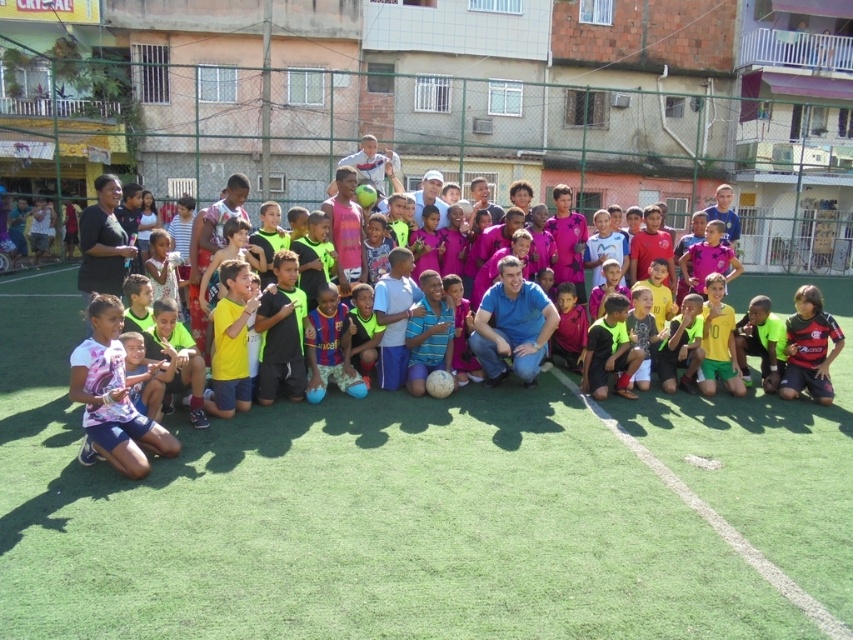
Is pink jersey at lower left behind pink fabric football team at center?

No, pink jersey at lower left is closer to the viewer.

This screenshot has height=640, width=853. What do you see at coordinates (112, 397) in the screenshot?
I see `pink jersey at lower left` at bounding box center [112, 397].

Where is `pink jersey at lower left`? The image size is (853, 640). pink jersey at lower left is located at coordinates (112, 397).

Based on the photo, does blue jersey at center come behind yellow jersey at lower center?

No, it is not.

Can you confirm if blue jersey at center is taller than yellow jersey at lower center?

Incorrect, blue jersey at center's height is not larger of yellow jersey at lower center's.

Who is more distant from viewer, [309,387] or [628,394]?

The point [628,394] is behind.

The height and width of the screenshot is (640, 853). In order to click on blue jersey at center in this screenshot , I will do `click(329, 342)`.

Is pink jersey at lower left to the left of blue jersey at center from the viewer's perspective?

Correct, you'll find pink jersey at lower left to the left of blue jersey at center.

In the scene shown: Does pink jersey at lower left have a lesser height compared to blue jersey at center?

Incorrect, pink jersey at lower left's height does not fall short of blue jersey at center's.

Who is more forward, [103,353] or [316,308]?

Point [103,353]

Identify the location of pink jersey at lower left. This screenshot has height=640, width=853. (112, 397).